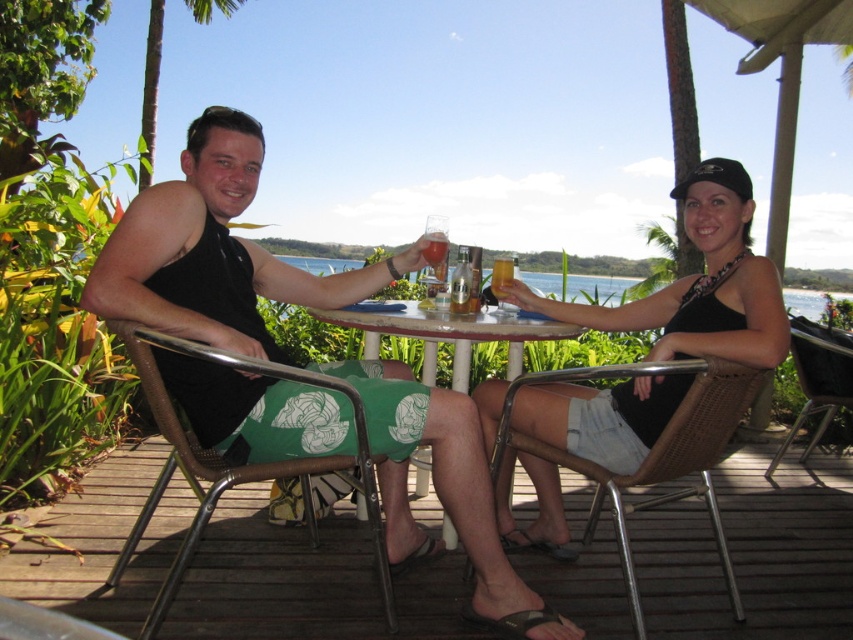
Question: Which object is the farthest from the white plastic table at center?

Choices:
 (A) translucent glass at center
 (B) wooden deck at lower center
 (C) black fabric dress at center

Answer: (B)

Question: Does wooden deck at lower center have a smaller size compared to matte black tank top at center?

Choices:
 (A) no
 (B) yes

Answer: (A)

Question: Is black fabric dress at center further to camera compared to clear water at table center?

Choices:
 (A) yes
 (B) no

Answer: (B)

Question: Does wooden deck at lower center have a smaller size compared to matte black tank top at center?

Choices:
 (A) yes
 (B) no

Answer: (B)

Question: Based on their relative distances, which object is farther from the black fabric dress at center?

Choices:
 (A) translucent glass at center
 (B) translucent glass at table center
 (C) matte black tank top at center

Answer: (A)

Question: Which of the following is the closest to the observer?

Choices:
 (A) (511, 272)
 (B) (141, 444)

Answer: (A)